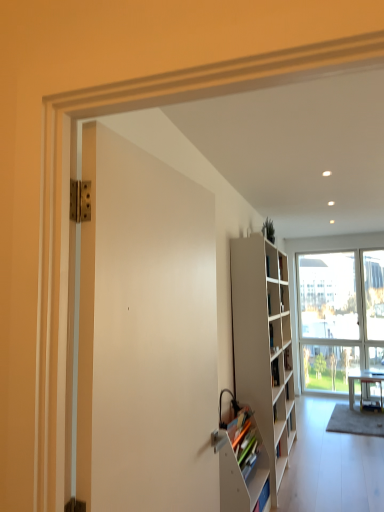
Question: From a real-world perspective, is white matte bookshelf at lower right located beneath white glossy desk at lower right?

Choices:
 (A) no
 (B) yes

Answer: (A)

Question: From a real-world perspective, is white matte bookshelf at lower right positioned over white glossy desk at lower right based on gravity?

Choices:
 (A) no
 (B) yes

Answer: (B)

Question: From the image's perspective, is white matte bookshelf at lower right located beneath white glossy desk at lower right?

Choices:
 (A) no
 (B) yes

Answer: (A)

Question: Are white matte bookshelf at lower right and white glossy desk at lower right making contact?

Choices:
 (A) no
 (B) yes

Answer: (A)

Question: Can you confirm if white matte bookshelf at lower right is wider than white glossy desk at lower right?

Choices:
 (A) yes
 (B) no

Answer: (B)

Question: Is white matte bookshelf at lower right thinner than white glossy desk at lower right?

Choices:
 (A) no
 (B) yes

Answer: (B)

Question: Is the depth of green matte plant at upper center less than that of white matte bookshelf at lower right?

Choices:
 (A) yes
 (B) no

Answer: (B)

Question: Is green matte plant at upper center outside of white matte bookshelf at lower right?

Choices:
 (A) no
 (B) yes

Answer: (B)

Question: Are green matte plant at upper center and white matte bookshelf at lower right beside each other?

Choices:
 (A) no
 (B) yes

Answer: (A)

Question: Is green matte plant at upper center far away from white matte bookshelf at lower right?

Choices:
 (A) yes
 (B) no

Answer: (A)

Question: Is green matte plant at upper center wider than white matte bookshelf at lower right?

Choices:
 (A) no
 (B) yes

Answer: (A)

Question: Is green matte plant at upper center at the right side of white matte bookshelf at lower right?

Choices:
 (A) no
 (B) yes

Answer: (B)

Question: Is the depth of white glass window at center less than that of white matte bookshelf at right?

Choices:
 (A) no
 (B) yes

Answer: (A)